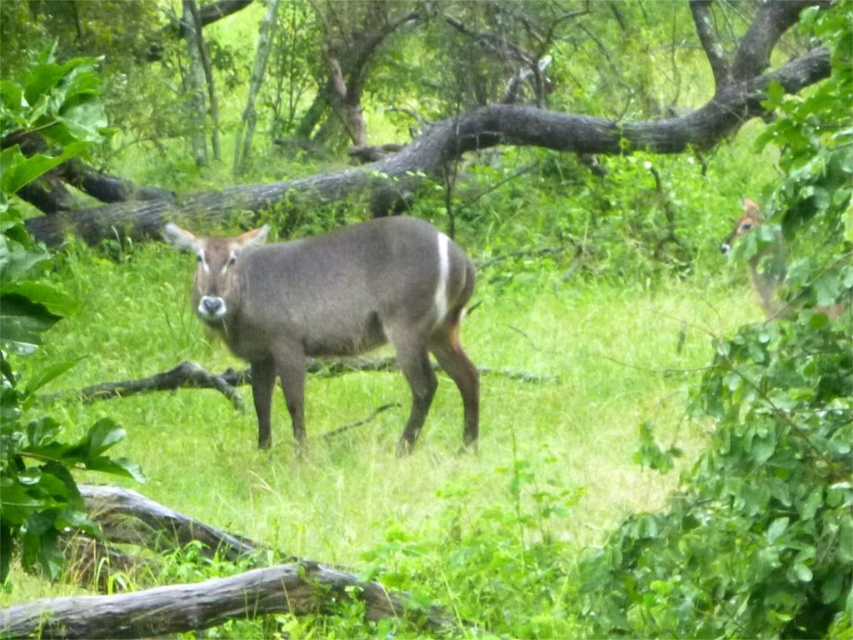
Measure the distance from gray matte deer at center to brown velvet deer at upper right.

The distance of gray matte deer at center from brown velvet deer at upper right is 7.12 feet.

Looking at this image, is gray matte deer at center positioned before brown velvet deer at upper right?

Yes, gray matte deer at center is closer to the viewer.

Which is in front, point (456, 310) or point (723, 240)?

Point (456, 310) is in front.

Find the location of a particular element. gray matte deer at center is located at coordinates (337, 307).

Which is more to the left, gray matte deer at center or green leafy tree at center?

gray matte deer at center is more to the left.

Is gray matte deer at center thinner than green leafy tree at center?

Indeed, gray matte deer at center has a lesser width compared to green leafy tree at center.

Which is in front, point (264, 404) or point (715, 124)?

Point (264, 404) is in front.

Identify the location of gray matte deer at center. (337, 307).

Is green leafy tree at center smaller than brown velvet deer at upper right?

Actually, green leafy tree at center might be larger than brown velvet deer at upper right.

You are a GUI agent. You are given a task and a screenshot of the screen. Output one action in this format:
    pyautogui.click(x=<x>, y=<y>)
    Task: Click on the green leafy tree at center
    Image resolution: width=853 pixels, height=640 pixels.
    Given the screenshot: What is the action you would take?
    pyautogui.click(x=498, y=134)

Does point (599, 124) come behind point (759, 288)?

Yes, point (599, 124) is farther from viewer.

The width and height of the screenshot is (853, 640). Identify the location of green leafy tree at center. (498, 134).